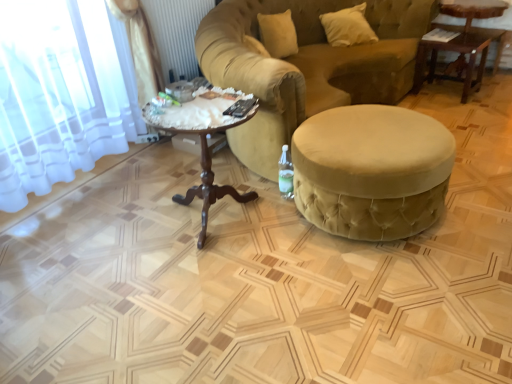
What are the coordinates of `clear glass bottle at lower right` in the screenshot? It's located at (286, 174).

Describe the element at coordinates (286, 174) in the screenshot. The image size is (512, 384). I see `clear glass bottle at lower right` at that location.

Locate an element on the screen. The width and height of the screenshot is (512, 384). white soft pillow at upper right is located at coordinates (x=347, y=27).

Where is `velvet yellow studio couch at center`? velvet yellow studio couch at center is located at coordinates (307, 66).

This screenshot has width=512, height=384. Describe the element at coordinates (372, 171) in the screenshot. I see `velvet beige ottoman at center, which is the first table in front-to-back order` at that location.

The height and width of the screenshot is (384, 512). I want to click on wooden table at upper right, placed as the second table when sorted from left to right, so point(460,43).

Between white soft pillow at upper right and velvet beige ottoman at center, which is the second table from back to front, which one appears on the left side from the viewer's perspective?

Positioned to the left is velvet beige ottoman at center, which is the second table from back to front.

Where is `the 2nd table in front of the white soft pillow at upper right`? This screenshot has height=384, width=512. the 2nd table in front of the white soft pillow at upper right is located at coordinates (372, 171).

From the image's perspective, between white soft pillow at upper right and velvet beige ottoman at center, which appears as the 1th table when ordered from the bottom, who is located below?

velvet beige ottoman at center, which appears as the 1th table when ordered from the bottom, from the image's perspective.

Looking at this image, which of these two, white soft pillow at upper right or velvet beige ottoman at center, the 2th table from the right, stands taller?

velvet beige ottoman at center, the 2th table from the right.

The image size is (512, 384). I want to click on table behind the velvet yellow studio couch at center, so click(460, 43).

Consider the image. How different are the orientations of wooden table at upper right, placed as the second table when sorted from front to back, and velvet yellow studio couch at center in degrees?

88.7 degrees.

Is velvet yellow studio couch at center completely or partially inside wooden table at upper right, which is counted as the 1th table, starting from the top?

Definitely not — velvet yellow studio couch at center is not inside wooden table at upper right, which is counted as the 1th table, starting from the top.

Could you tell me if wooden table at upper right, which ranks as the 1th table in back-to-front order, is facing velvet yellow studio couch at center?

No, wooden table at upper right, which ranks as the 1th table in back-to-front order, is not turned towards velvet yellow studio couch at center.

Considering their positions, is mahogany wood coffee table at center located in front of or behind wooden table at upper right, acting as the first table starting from the right?

Clearly, mahogany wood coffee table at center is in front of wooden table at upper right, acting as the first table starting from the right.

Consider the image. From a real-world perspective, is mahogany wood coffee table at center on wooden table at upper right, acting as the first table starting from the right?

Incorrect, from a real-world perspective, mahogany wood coffee table at center is lower than wooden table at upper right, acting as the first table starting from the right.

In order to click on table behind the mahogany wood coffee table at center in this screenshot , I will do `click(460, 43)`.

Would you say mahogany wood coffee table at center is outside wooden table at upper right, acting as the first table starting from the right?

Absolutely, mahogany wood coffee table at center is external to wooden table at upper right, acting as the first table starting from the right.

Which is nearer, (238, 11) or (147, 109)?

Clearly, point (238, 11) is more distant from the camera than point (147, 109).

Considering the positions of objects velvet yellow studio couch at center and mahogany wood coffee table at center in the image provided, who is in front, velvet yellow studio couch at center or mahogany wood coffee table at center?

mahogany wood coffee table at center is more forward.

Which is correct: velvet yellow studio couch at center is inside mahogany wood coffee table at center, or outside of it?

velvet yellow studio couch at center cannot be found inside mahogany wood coffee table at center.

Does velvet yellow studio couch at center have a greater height compared to mahogany wood coffee table at center?

Yes.

From the image's perspective, which is above, velvet beige ottoman at center, the second table in the top-to-bottom sequence, or wooden table at upper right, acting as the first table starting from the right?

From the image's view, wooden table at upper right, acting as the first table starting from the right, is above.

Considering the relative positions of velvet beige ottoman at center, which is the second table from back to front, and wooden table at upper right, placed as the second table when sorted from left to right, in the image provided, is velvet beige ottoman at center, which is the second table from back to front, to the left or to the right of wooden table at upper right, placed as the second table when sorted from left to right,?

Based on their positions, velvet beige ottoman at center, which is the second table from back to front, is located to the left of wooden table at upper right, placed as the second table when sorted from left to right.

Would you consider velvet beige ottoman at center, which is the first table in left-to-right order, to be distant from wooden table at upper right, which ranks as the 1th table in back-to-front order?

That's right, there is a large distance between velvet beige ottoman at center, which is the first table in left-to-right order, and wooden table at upper right, which ranks as the 1th table in back-to-front order.

Is velvet beige ottoman at center, which is the second table from back to front, oriented away from wooden table at upper right, placed as the second table when sorted from left to right?

No, velvet beige ottoman at center, which is the second table from back to front, is not facing the opposite direction of wooden table at upper right, placed as the second table when sorted from left to right.

Relative to velvet yellow studio couch at center, is white soft pillow at upper right in front or behind?

white soft pillow at upper right is behind velvet yellow studio couch at center.

Is white soft pillow at upper right oriented away from velvet yellow studio couch at center?

Yes.

Between white soft pillow at upper right and velvet yellow studio couch at center, which one has smaller size?

white soft pillow at upper right.

How much distance is there between white soft pillow at upper right and velvet yellow studio couch at center?

They are 21.96 inches apart.

Which of these two, wooden table at upper right, placed as the second table when sorted from left to right, or white soft pillow at upper right, stands taller?

With more height is wooden table at upper right, placed as the second table when sorted from left to right.

Considering the points (469, 28) and (321, 21), which point is in front, point (469, 28) or point (321, 21)?

The point (469, 28) is closer.

How different are the orientations of wooden table at upper right, which ranks as the 1th table in back-to-front order, and white soft pillow at upper right in degrees?

The angular difference between wooden table at upper right, which ranks as the 1th table in back-to-front order, and white soft pillow at upper right is 39.2 degrees.

From a real-world perspective, count 2nd tables downward from the white soft pillow at upper right and point to it. Please provide its 2D coordinates.

[(372, 171)]

This screenshot has height=384, width=512. What are the coordinates of `studio couch that is on the left side of wooden table at upper right, placed as the second table when sorted from front to back` in the screenshot? It's located at (307, 66).

Estimate the real-world distances between objects in this image. Which object is further from velvet beige ottoman at center, which is the first table in front-to-back order, mahogany wood coffee table at center or clear glass bottle at lower right?

mahogany wood coffee table at center.

Considering their positions, is clear glass bottle at lower right positioned closer to wooden table at upper right, which ranks as the 1th table in back-to-front order, than mahogany wood coffee table at center?

clear glass bottle at lower right lies closer to wooden table at upper right, which ranks as the 1th table in back-to-front order, than the other object.

Which object lies further to the anchor point mahogany wood coffee table at center, white soft pillow at upper right or velvet beige ottoman at center, which is the second table from back to front?

The object further to mahogany wood coffee table at center is white soft pillow at upper right.

In the scene shown: Considering their positions, is clear glass bottle at lower right positioned closer to velvet yellow studio couch at center than white soft pillow at upper right?

white soft pillow at upper right is closer to velvet yellow studio couch at center.

From the image, which object appears to be nearer to wooden table at upper right, placed as the second table when sorted from front to back, mahogany wood coffee table at center or white soft pillow at upper right?

white soft pillow at upper right.

Estimate the real-world distances between objects in this image. Which object is further from white soft pillow at upper right, mahogany wood coffee table at center or wooden table at upper right, acting as the first table starting from the right?

mahogany wood coffee table at center is positioned further to the anchor white soft pillow at upper right.

Looking at the image, which one is located closer to mahogany wood coffee table at center, velvet beige ottoman at center, the 2th table from the right, or wooden table at upper right, placed as the 2th table when sorted from bottom to top?

velvet beige ottoman at center, the 2th table from the right, is closer to mahogany wood coffee table at center.

Looking at the image, which one is located further to clear glass bottle at lower right, wooden table at upper right, placed as the second table when sorted from left to right, or velvet yellow studio couch at center?

wooden table at upper right, placed as the second table when sorted from left to right, is further to clear glass bottle at lower right.

The height and width of the screenshot is (384, 512). I want to click on table between velvet yellow studio couch at center and clear glass bottle at lower right from top to bottom, so click(372, 171).

In order to click on studio couch located between mahogany wood coffee table at center and wooden table at upper right, which ranks as the 1th table in back-to-front order, in the left-right direction in this screenshot , I will do `click(307, 66)`.

This screenshot has height=384, width=512. Identify the location of table located between clear glass bottle at lower right and wooden table at upper right, which is counted as the 1th table, starting from the top, in the left-right direction. (372, 171).

Where is `studio couch positioned between velvet beige ottoman at center, the 2th table from the right, and white soft pillow at upper right from near to far`? studio couch positioned between velvet beige ottoman at center, the 2th table from the right, and white soft pillow at upper right from near to far is located at coordinates (307, 66).